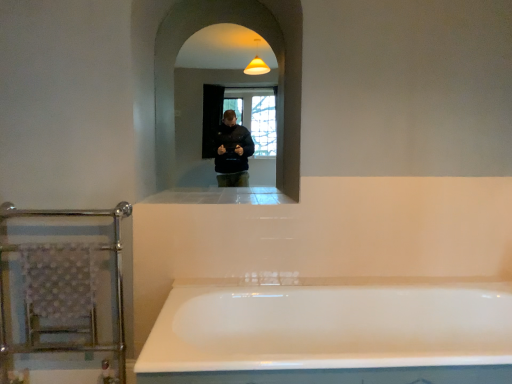
Question: Can you confirm if white glossy bathtub at center is positioned to the right of white glossy ledge at center?

Choices:
 (A) no
 (B) yes

Answer: (B)

Question: Is the depth of white glossy bathtub at center greater than that of white glossy ledge at center?

Choices:
 (A) no
 (B) yes

Answer: (A)

Question: Does white glossy bathtub at center have a larger size compared to white glossy ledge at center?

Choices:
 (A) yes
 (B) no

Answer: (A)

Question: Is white glossy bathtub at center thinner than white glossy ledge at center?

Choices:
 (A) yes
 (B) no

Answer: (B)

Question: Considering the relative sizes of white glossy bathtub at center and white glossy ledge at center in the image provided, is white glossy bathtub at center wider than white glossy ledge at center?

Choices:
 (A) no
 (B) yes

Answer: (B)

Question: Is white glossy bathtub at center directly adjacent to white glossy ledge at center?

Choices:
 (A) yes
 (B) no

Answer: (B)

Question: Does clear glass mirror at center have a smaller size compared to white glossy bathtub at center?

Choices:
 (A) no
 (B) yes

Answer: (B)

Question: Is clear glass mirror at center shorter than white glossy bathtub at center?

Choices:
 (A) yes
 (B) no

Answer: (B)

Question: Does clear glass mirror at center have a lesser width compared to white glossy bathtub at center?

Choices:
 (A) yes
 (B) no

Answer: (A)

Question: Is clear glass mirror at center outside of white glossy bathtub at center?

Choices:
 (A) yes
 (B) no

Answer: (A)

Question: Is clear glass mirror at center to the right of white glossy bathtub at center from the viewer's perspective?

Choices:
 (A) no
 (B) yes

Answer: (A)

Question: From a real-world perspective, is clear glass mirror at center physically above white glossy bathtub at center?

Choices:
 (A) yes
 (B) no

Answer: (A)

Question: Is clear glass mirror at center at the right side of white glossy ledge at center?

Choices:
 (A) no
 (B) yes

Answer: (A)